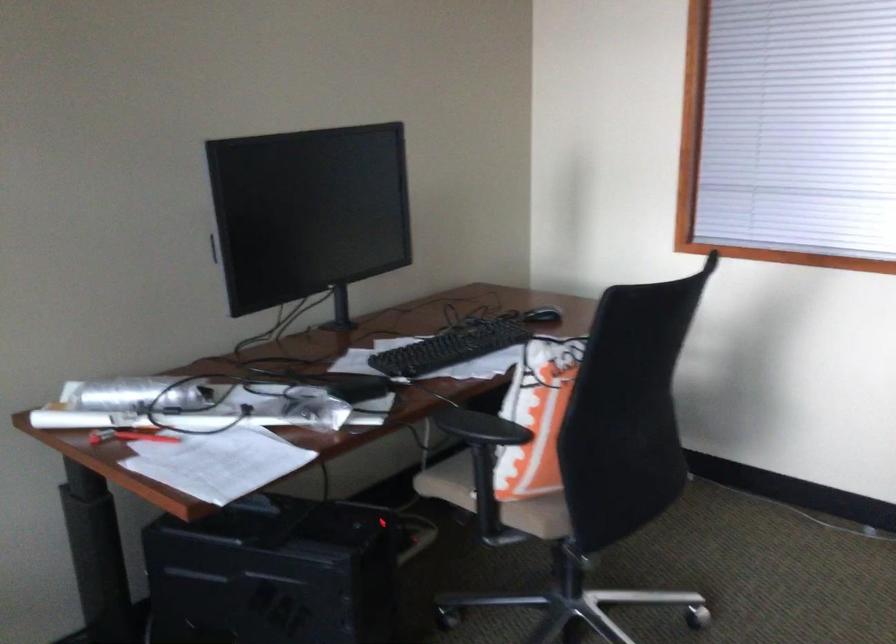
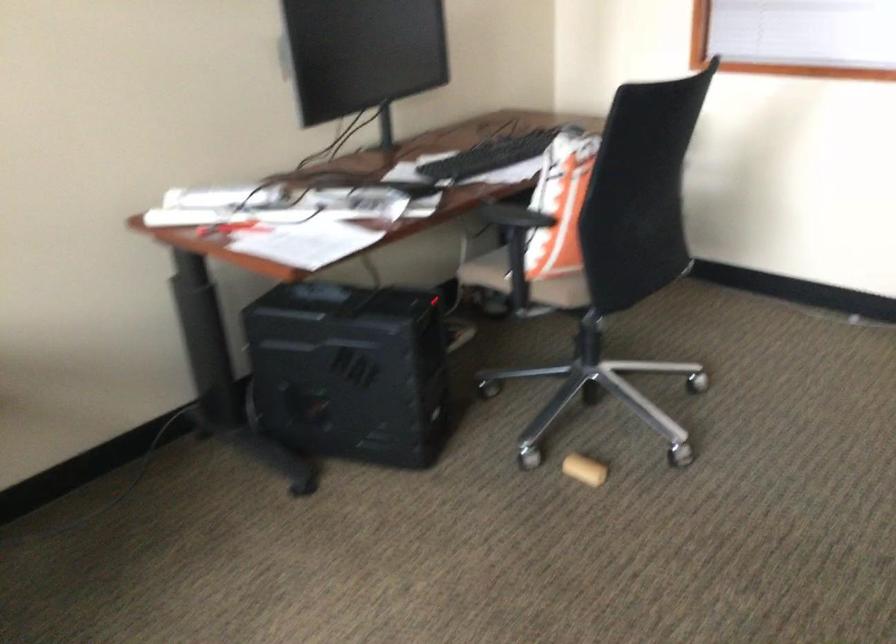
Question: The images are taken continuously from a first-person perspective. In which direction are you moving?

Choices:
 (A) Left
 (B) Right
 (C) Forward
 (D) Backward

Answer: (D)